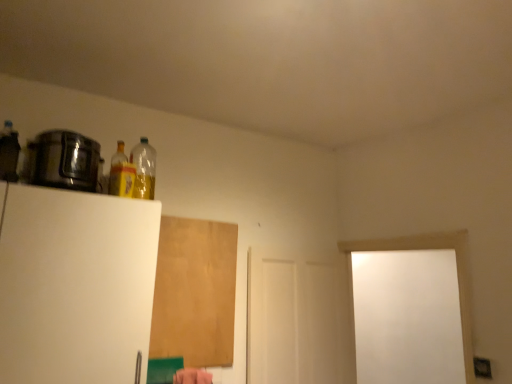
Question: Is white matte door at center facing away from white matte door at right?

Choices:
 (A) yes
 (B) no

Answer: (B)

Question: Is white matte door at center positioned in front of white matte door at right?

Choices:
 (A) yes
 (B) no

Answer: (B)

Question: Can you confirm if white matte door at center is smaller than white matte door at right?

Choices:
 (A) yes
 (B) no

Answer: (A)

Question: From a real-world perspective, is white matte door at center located higher than white matte door at right?

Choices:
 (A) no
 (B) yes

Answer: (A)

Question: Could you tell me if white matte door at center is turned towards white matte door at right?

Choices:
 (A) yes
 (B) no

Answer: (A)

Question: In the image, is brown matte plywood at upper center positioned in front of or behind white matte refrigerator at left, the first appliance positioned from the bottom?

Choices:
 (A) front
 (B) behind

Answer: (B)

Question: Is brown matte plywood at upper center situated inside white matte refrigerator at left, which is the 2th appliance from top to bottom, or outside?

Choices:
 (A) outside
 (B) inside

Answer: (A)

Question: Is point (211, 324) closer or farther from the camera than point (24, 339)?

Choices:
 (A) farther
 (B) closer

Answer: (A)

Question: From a real-world perspective, relative to white matte refrigerator at left, which is the 2th appliance from top to bottom, is brown matte plywood at upper center vertically above or below?

Choices:
 (A) above
 (B) below

Answer: (A)

Question: Considering their positions, is matte black bottle at upper left, which is counted as the 1th bottle, starting from the front, located in front of or behind translucent plastic bottle at upper left, acting as the 1th bottle starting from the back?

Choices:
 (A) front
 (B) behind

Answer: (A)

Question: From a real-world perspective, relative to translucent plastic bottle at upper left, the 3th bottle when ordered from left to right, is matte black bottle at upper left, which is counted as the 1th bottle, starting from the front, vertically above or below?

Choices:
 (A) below
 (B) above

Answer: (A)

Question: Is point (1, 135) closer or farther from the camera than point (151, 190)?

Choices:
 (A) farther
 (B) closer

Answer: (B)

Question: Do you think matte black bottle at upper left, marked as the 1th bottle in a left-to-right arrangement, is within translucent plastic bottle at upper left, which is counted as the 1th bottle, starting from the right, or outside of it?

Choices:
 (A) outside
 (B) inside

Answer: (A)

Question: In the image, is translucent plastic bottle at upper left, acting as the 1th bottle starting from the back, on the left side or the right side of shiny metallic pot at left, arranged as the 1th appliance when viewed from the top?

Choices:
 (A) left
 (B) right

Answer: (B)

Question: From a real-world perspective, is translucent plastic bottle at upper left, which is counted as the 1th bottle, starting from the right, physically located above or below shiny metallic pot at left, the second appliance when ordered from bottom to top?

Choices:
 (A) above
 (B) below

Answer: (A)